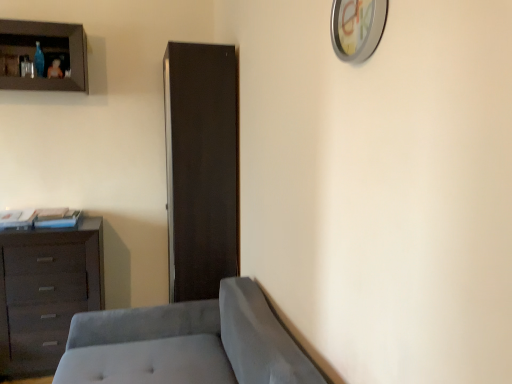
What are the coordinates of `dark brown wooden chest of drawers at left` in the screenshot? It's located at (46, 292).

This screenshot has height=384, width=512. What do you see at coordinates (46, 292) in the screenshot?
I see `dark brown wooden chest of drawers at left` at bounding box center [46, 292].

Image resolution: width=512 pixels, height=384 pixels. In order to click on suede gray studio couch at lower left in this screenshot , I will do `click(187, 344)`.

Measure the distance between point (21,36) and camera.

The depth of point (21,36) is 2.49 meters.

What are the coordinates of `matte brown cabinet at upper left` in the screenshot? It's located at (45, 50).

The height and width of the screenshot is (384, 512). I want to click on matte black cabinet at center, so click(201, 167).

Identify the location of cupboard behind the suede gray studio couch at lower left. This screenshot has width=512, height=384. (45, 50).

Does matte brown cabinet at upper left lie behind suede gray studio couch at lower left?

That is True.

From the image's perspective, would you say matte brown cabinet at upper left is positioned over suede gray studio couch at lower left?

Yes, from the image's perspective, matte brown cabinet at upper left is on top of suede gray studio couch at lower left.

Is dark brown wooden chest of drawers at left at the right side of matte brown cabinet at upper left?

Yes.

Which object is thinner, dark brown wooden chest of drawers at left or matte brown cabinet at upper left?

With smaller width is matte brown cabinet at upper left.

Which is correct: dark brown wooden chest of drawers at left is inside matte brown cabinet at upper left, or outside of it?

dark brown wooden chest of drawers at left is spatially situated outside matte brown cabinet at upper left.

How different are the orientations of dark brown wooden chest of drawers at left and suede gray studio couch at lower left in degrees?

The facing directions of dark brown wooden chest of drawers at left and suede gray studio couch at lower left are 90.8 degrees apart.

Is dark brown wooden chest of drawers at left oriented away from suede gray studio couch at lower left?

No, suede gray studio couch at lower left is not at the back of dark brown wooden chest of drawers at left.

Does dark brown wooden chest of drawers at left have a greater width compared to suede gray studio couch at lower left?

No.

From their relative heights in the image, would you say dark brown wooden chest of drawers at left is taller or shorter than suede gray studio couch at lower left?

Clearly, dark brown wooden chest of drawers at left is taller compared to suede gray studio couch at lower left.

Between metallic clock at upper right and matte brown cabinet at upper left, which one appears on the left side from the viewer's perspective?

matte brown cabinet at upper left.

Is metallic clock at upper right inside the boundaries of matte brown cabinet at upper left, or outside?

metallic clock at upper right is outside matte brown cabinet at upper left.

Can you confirm if metallic clock at upper right is bigger than matte brown cabinet at upper left?

Actually, metallic clock at upper right might be smaller than matte brown cabinet at upper left.

What's the angular difference between metallic clock at upper right and matte brown cabinet at upper left's facing directions?

There is a 91.1-degree angle between the facing directions of metallic clock at upper right and matte brown cabinet at upper left.

In the image, there is a dark brown wooden chest of drawers at left. Where is `studio couch below it (from a real-world perspective)`? Image resolution: width=512 pixels, height=384 pixels. studio couch below it (from a real-world perspective) is located at coordinates (187, 344).

From the image's perspective, is suede gray studio couch at lower left under dark brown wooden chest of drawers at left?

Yes.

Does suede gray studio couch at lower left have a greater width compared to dark brown wooden chest of drawers at left?

Correct, the width of suede gray studio couch at lower left exceeds that of dark brown wooden chest of drawers at left.

Is metallic clock at upper right facing away from suede gray studio couch at lower left?

No, suede gray studio couch at lower left is not at the back of metallic clock at upper right.

Is metallic clock at upper right positioned before suede gray studio couch at lower left?

No, metallic clock at upper right is behind suede gray studio couch at lower left.

Based on the photo, between metallic clock at upper right and suede gray studio couch at lower left, which one has smaller width?

metallic clock at upper right.

Based on the photo, which is farther from the camera, (208, 189) or (44, 319)?

The point (44, 319) is more distant.

Is dark brown wooden chest of drawers at left located within matte black cabinet at center?

No, dark brown wooden chest of drawers at left is not a part of matte black cabinet at center.

Between matte black cabinet at center and dark brown wooden chest of drawers at left, which one appears on the right side from the viewer's perspective?

From the viewer's perspective, matte black cabinet at center appears more on the right side.

Find the location of a particular element. file cabinet lying above the dark brown wooden chest of drawers at left (from the image's perspective) is located at coordinates (201, 167).

Locate an element on the screen. This screenshot has width=512, height=384. cupboard on the left of suede gray studio couch at lower left is located at coordinates (45, 50).

Find the location of a particular element. The image size is (512, 384). cupboard lying in front of the dark brown wooden chest of drawers at left is located at coordinates (45, 50).

Considering their positions, is metallic clock at upper right positioned closer to matte brown cabinet at upper left than suede gray studio couch at lower left?

suede gray studio couch at lower left is positioned closer to the anchor matte brown cabinet at upper left.

When comparing their distances from dark brown wooden chest of drawers at left, does suede gray studio couch at lower left or matte black cabinet at center seem closer?

suede gray studio couch at lower left lies closer to dark brown wooden chest of drawers at left than the other object.

Considering their positions, is matte black cabinet at center positioned closer to matte brown cabinet at upper left than dark brown wooden chest of drawers at left?

matte black cabinet at center is closer to matte brown cabinet at upper left.

Estimate the real-world distances between objects in this image. Which object is closer to metallic clock at upper right, suede gray studio couch at lower left or matte black cabinet at center?

suede gray studio couch at lower left lies closer to metallic clock at upper right than the other object.

Looking at the image, which one is located closer to matte black cabinet at center, dark brown wooden chest of drawers at left or matte brown cabinet at upper left?

dark brown wooden chest of drawers at left is positioned closer to the anchor matte black cabinet at center.

Considering their positions, is matte brown cabinet at upper left positioned closer to dark brown wooden chest of drawers at left than metallic clock at upper right?

matte brown cabinet at upper left.

Which object lies nearer to the anchor point suede gray studio couch at lower left, matte brown cabinet at upper left or dark brown wooden chest of drawers at left?

dark brown wooden chest of drawers at left is closer to suede gray studio couch at lower left.

Looking at the image, which one is located closer to matte brown cabinet at upper left, metallic clock at upper right or matte black cabinet at center?

Among the two, matte black cabinet at center is located nearer to matte brown cabinet at upper left.

Locate an element on the screen. The width and height of the screenshot is (512, 384). the chest of drawers located between matte brown cabinet at upper left and metallic clock at upper right in the left-right direction is located at coordinates (46, 292).

You are a GUI agent. You are given a task and a screenshot of the screen. Output one action in this format:
    pyautogui.click(x=<x>, y=<y>)
    Task: Click on the file cabinet between dark brown wooden chest of drawers at left and metallic clock at upper right from left to right
    The height and width of the screenshot is (384, 512).
    Given the screenshot: What is the action you would take?
    pyautogui.click(x=201, y=167)

The height and width of the screenshot is (384, 512). Find the location of `file cabinet between suede gray studio couch at lower left and dark brown wooden chest of drawers at left in the front-back direction`. file cabinet between suede gray studio couch at lower left and dark brown wooden chest of drawers at left in the front-back direction is located at coordinates click(201, 167).

Where is `studio couch between dark brown wooden chest of drawers at left and metallic clock at upper right from left to right`? Image resolution: width=512 pixels, height=384 pixels. studio couch between dark brown wooden chest of drawers at left and metallic clock at upper right from left to right is located at coordinates (187, 344).